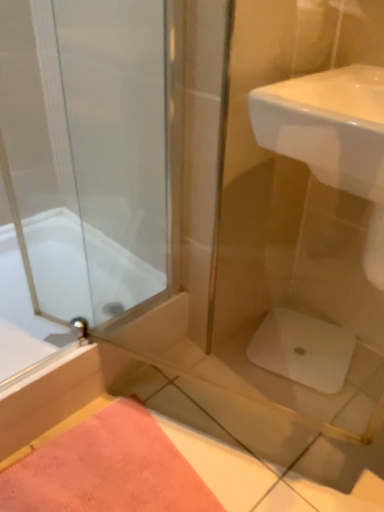
Identify the location of vacant area on top of pink fabric bath mat at lower left (from a real-world perspective). Image resolution: width=384 pixels, height=512 pixels. (102, 465).